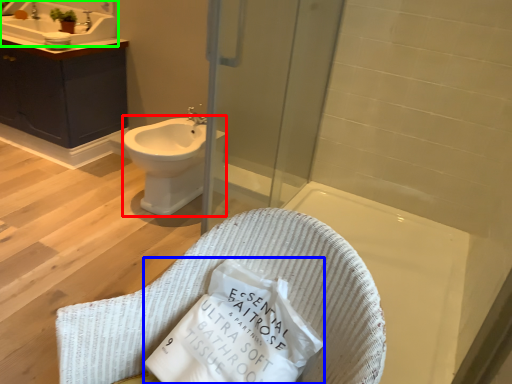
Question: Estimate the real-world distances between objects in this image. Which object is closer to bidet (highlighted by a red box), material (highlighted by a blue box) or sink (highlighted by a green box)?

Choices:
 (A) material
 (B) sink

Answer: (B)